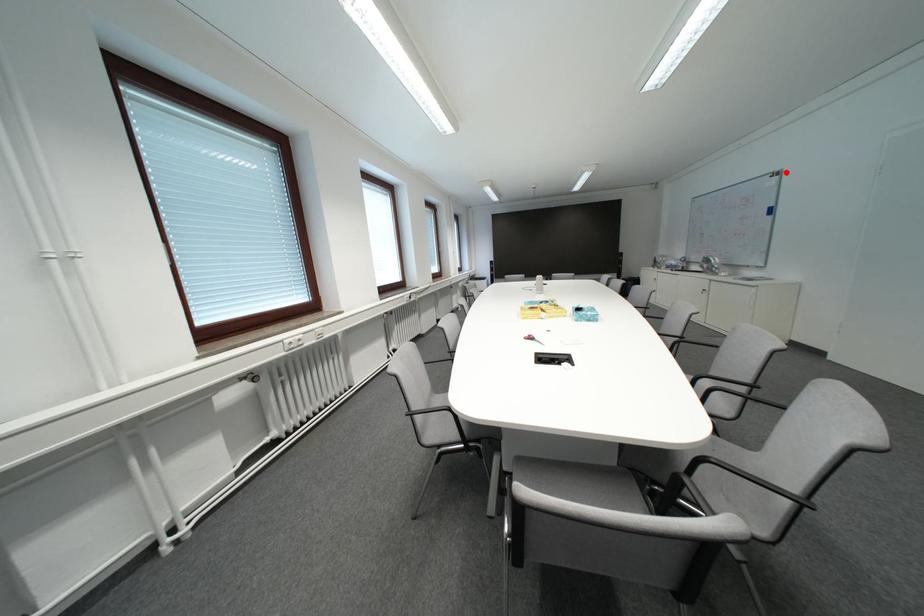
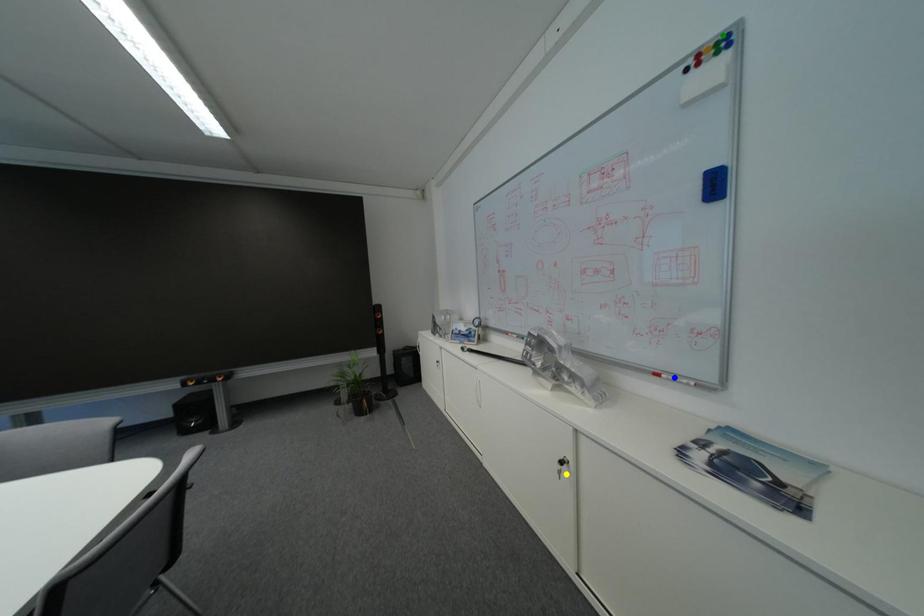
Question: I am providing you with two images of the same scene from different viewpoints. A red point is marked on the first image. You are given multiple points on the second image. Which point in image 2 is actually the same real-world point as the red point in image 1?

Choices:
 (A) green point
 (B) yellow point
 (C) blue point

Answer: (A)